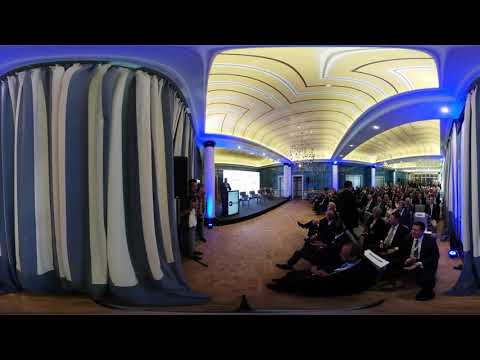
Locate an element on the screen. The width and height of the screenshot is (480, 360). brown floor is located at coordinates (241, 252).